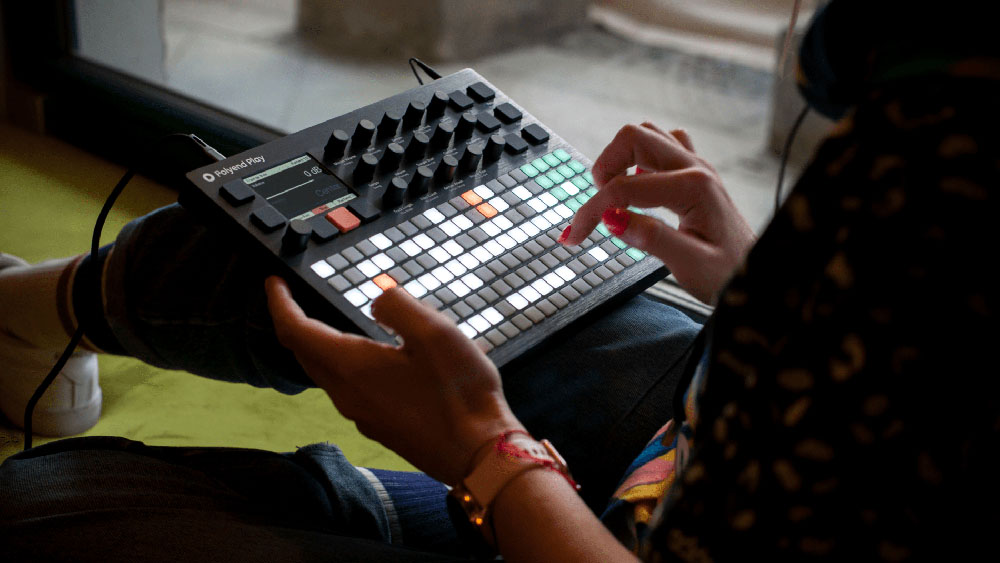
The image size is (1000, 563). Identify the location of black buttons at top of keyboard. (537, 131), (509, 113), (484, 90), (467, 95), (487, 117), (514, 142), (267, 220), (229, 189), (366, 211), (325, 230).